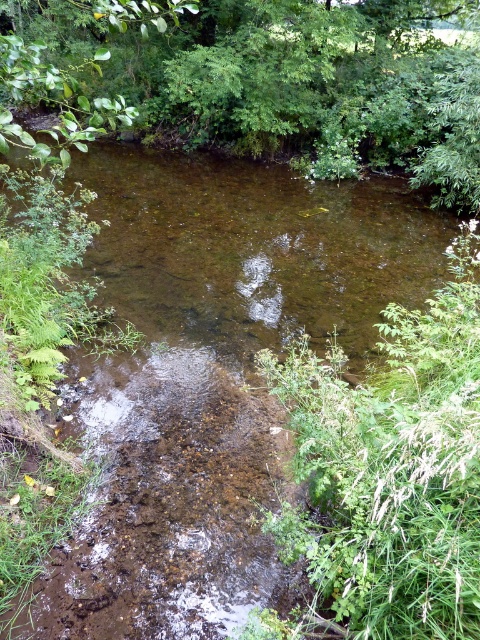
Between green leafy tree at upper center and brown muddy stream at center, which one appears on the right side from the viewer's perspective?

brown muddy stream at center is more to the right.

Is point (213, 132) in front of point (126, 604)?

No, (213, 132) is behind (126, 604).

What are the coordinates of `green leafy tree at upper center` in the screenshot? It's located at (272, 80).